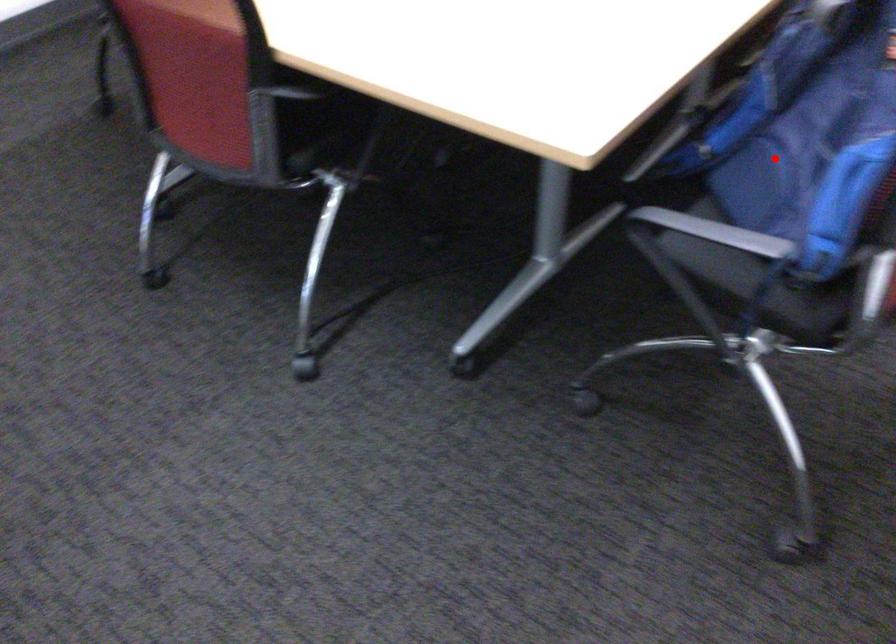
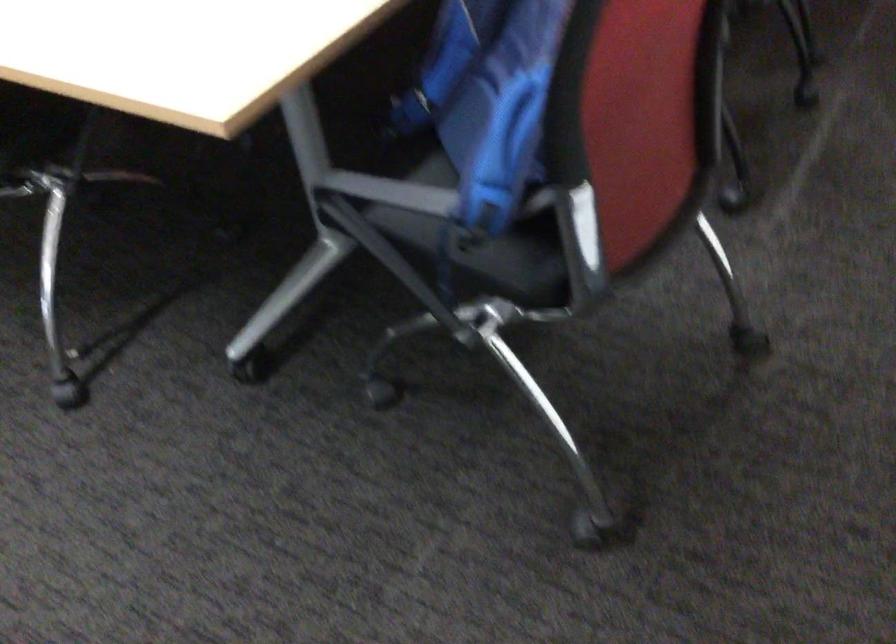
Where in the second image is the point corresponding to the highlighted location from the first image?

(487, 98)